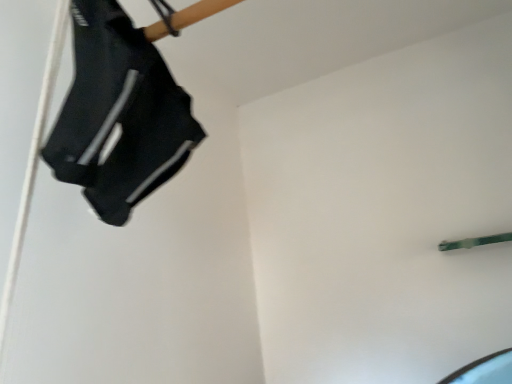
What is the approximate width of black fabric shoe at upper left?

It is 4.34 inches.

This screenshot has width=512, height=384. Describe the element at coordinates (119, 114) in the screenshot. I see `black fabric shoe at upper left` at that location.

Find the location of a particular element. black fabric shoe at upper left is located at coordinates (119, 114).

Locate an element on the screen. The image size is (512, 384). black fabric shoe at upper left is located at coordinates (119, 114).